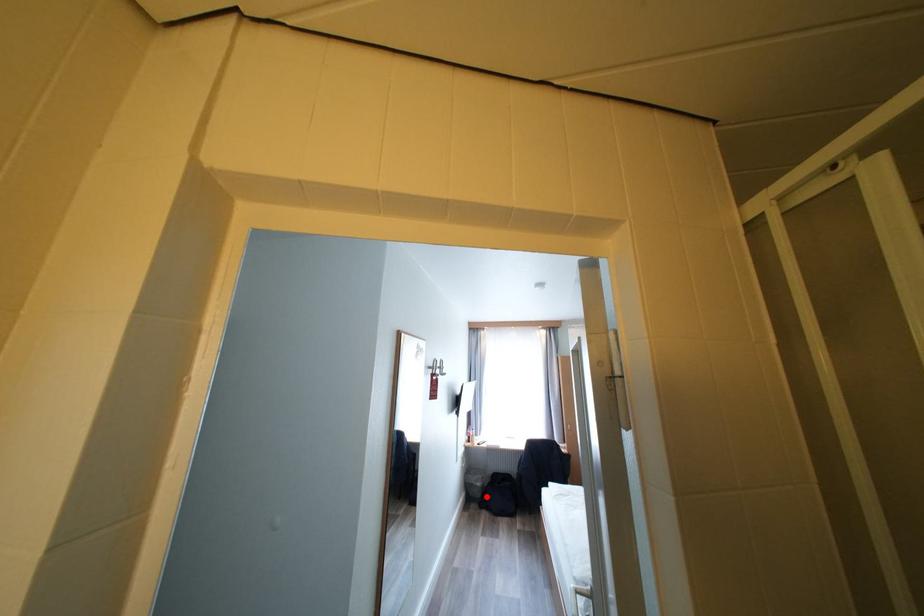
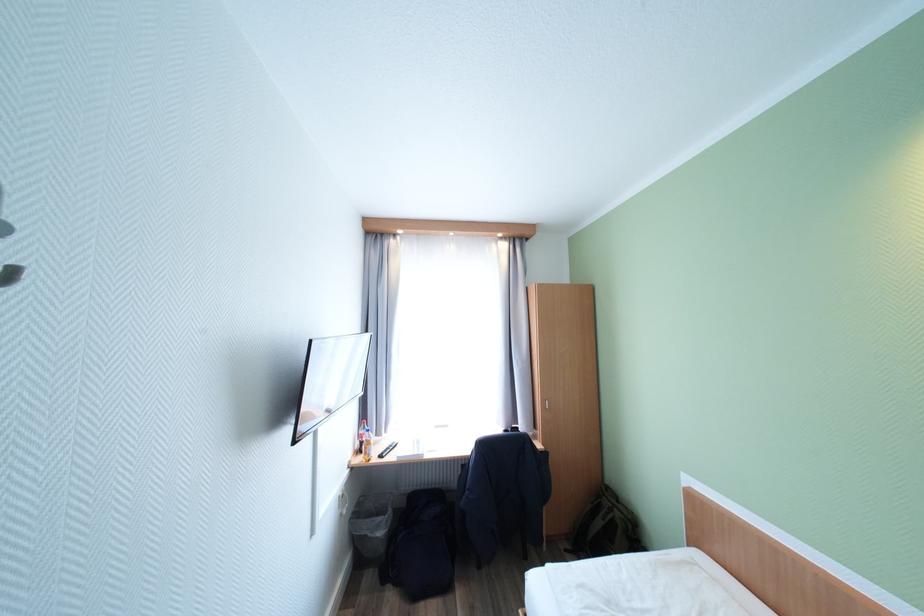
Question: I am providing you with two images of the same scene from different viewpoints. Given a red point in image1, look at the same physical point in image2. Is it:

Choices:
 (A) Closer to the viewpoint
 (B) Farther from the viewpoint

Answer: (A)